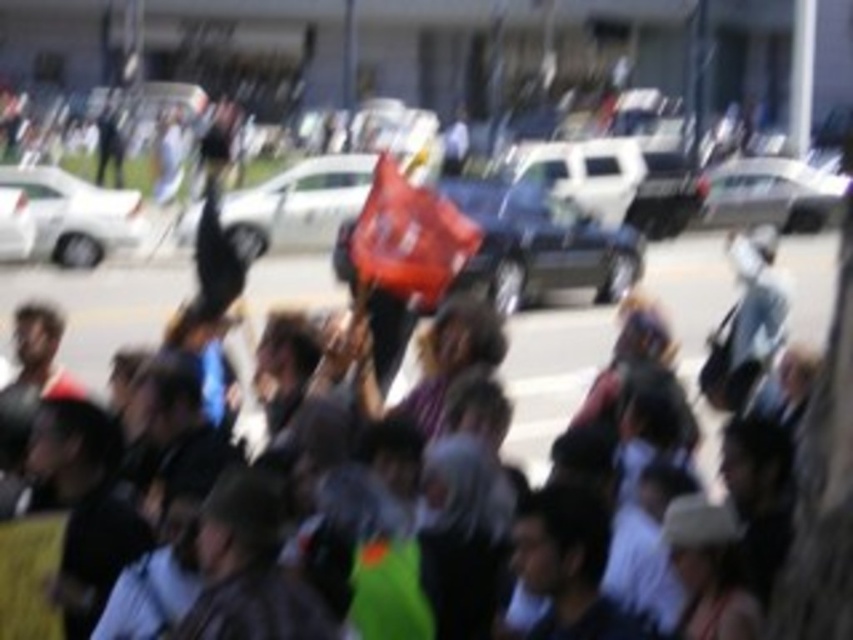
You are a delivery driver who needs to park your matte white car at center in this area. The parking spot is located at coordinates point 0.317, 0.354. Can you safely park your car there?

Yes, the matte white car at center is already located at point (300,202), so it is safe to park there.

You are a photographer who wants to capture a clear image of the metallic silver car at center. Given the current blurry image, what might be the best position to stand relative to the point marked at coordinates point (541, 246) to ensure the car is in focus?

The point marked at coordinates point (541, 246) marks the metallic silver car at center. To ensure the car is in focus, you should position yourself directly facing the car at this point, ensuring the camera is aligned with the car and minimizing motion blur by using a tripod or faster shutter speed.

You are a photographer trying to capture a clear image of the white matte car at left and the white glossy sedan at upper right. Based on their positions, which car is closer to the camera?

The white matte car at left is located below the white glossy sedan at upper right, which typically indicates that it is closer to the camera since objects lower in the frame are often nearer in such compositions.